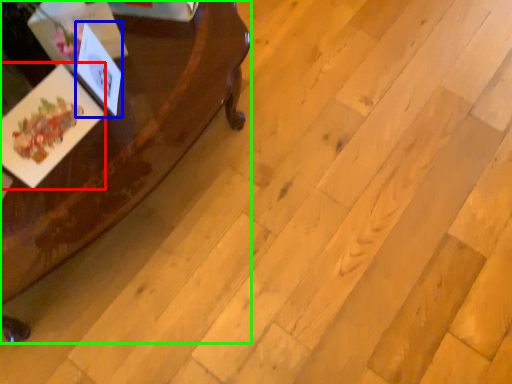
Question: Which object is positioned closest to postcard (highlighted by a red box)? Select from postcard (highlighted by a blue box) and table (highlighted by a green box).

Choices:
 (A) postcard
 (B) table

Answer: (A)